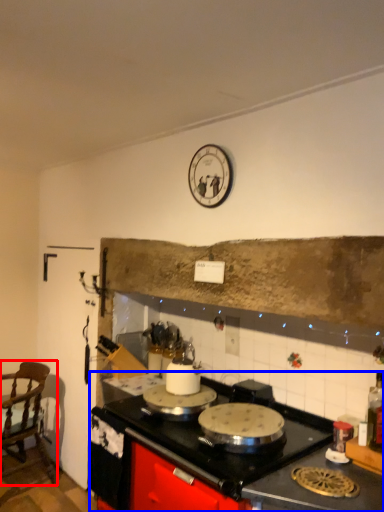
Question: Which point is further to the camera, chair (highlighted by a red box) or countertop (highlighted by a blue box)?

Choices:
 (A) chair
 (B) countertop

Answer: (A)